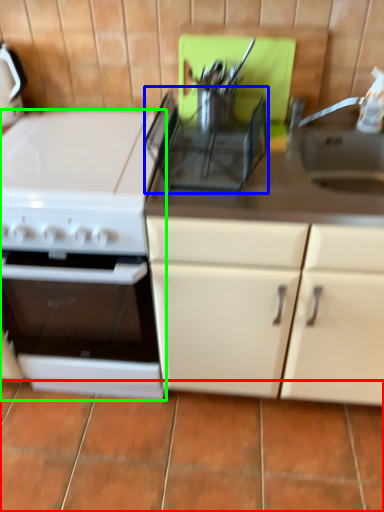
Question: Considering the real-world distances, which object is farthest from tile (highlighted by a red box)? appliance (highlighted by a blue box) or kitchen appliance (highlighted by a green box)?

Choices:
 (A) appliance
 (B) kitchen appliance

Answer: (A)